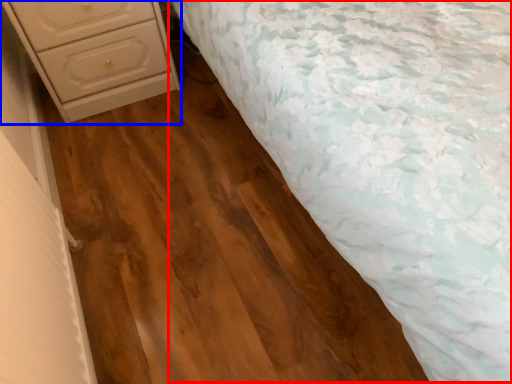
Question: Which point is further to the camera, bed (highlighted by a red box) or chest of drawers (highlighted by a blue box)?

Choices:
 (A) bed
 (B) chest of drawers

Answer: (B)